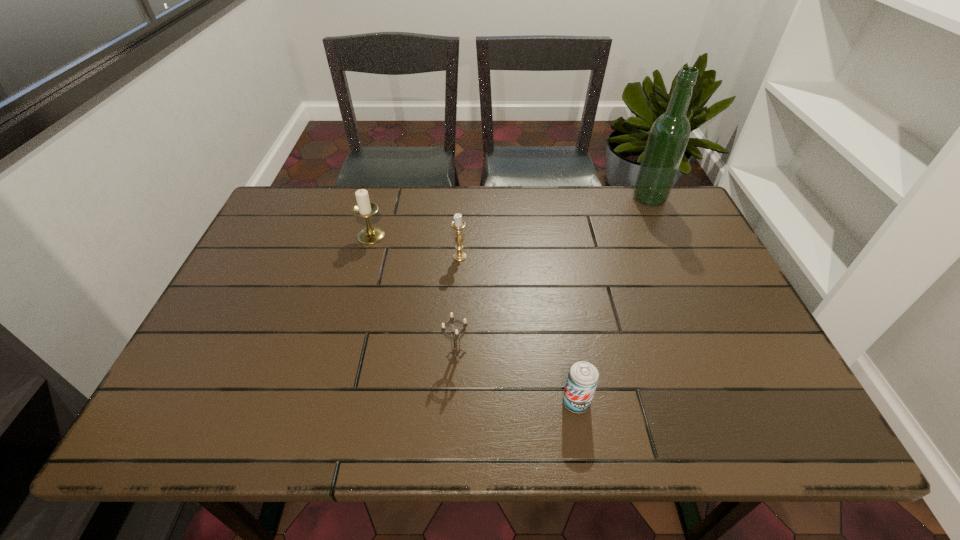
Locate an element on the screen. vacant space located on the front of the fourth nearest object is located at coordinates (348, 321).

Where is `vacant space located on the front of the third farthest object`? vacant space located on the front of the third farthest object is located at coordinates (457, 312).

Locate an element on the screen. The image size is (960, 540). free location located on the back of the nearest candle holder is located at coordinates (460, 276).

Identify the location of vacant space located 0.270m on the back of the nearest object. (558, 295).

At what (x,y) coordinates should I click in order to perform the action: click on liquor situated at the far edge. Please return your answer as a coordinate pair (x, y). The width and height of the screenshot is (960, 540). Looking at the image, I should click on (669, 134).

This screenshot has height=540, width=960. What are the coordinates of `candle holder located at the far edge` in the screenshot? It's located at (364, 208).

This screenshot has height=540, width=960. I want to click on object that is at the near edge, so click(583, 377).

Where is `object that is at the right edge`? The height and width of the screenshot is (540, 960). object that is at the right edge is located at coordinates (669, 134).

You are a GUI agent. You are given a task and a screenshot of the screen. Output one action in this format:
    pyautogui.click(x=<x>, y=<y>)
    Task: Click on the object present at the far right corner
    
    Given the screenshot: What is the action you would take?
    pyautogui.click(x=669, y=134)

The width and height of the screenshot is (960, 540). What are the coordinates of `free spot at the far edge of the desktop` in the screenshot? It's located at (521, 219).